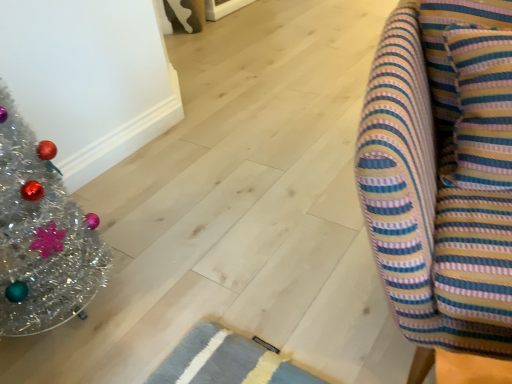
Where is `vacant space behind shiny silver christmas tree at left`? This screenshot has width=512, height=384. vacant space behind shiny silver christmas tree at left is located at coordinates (126, 205).